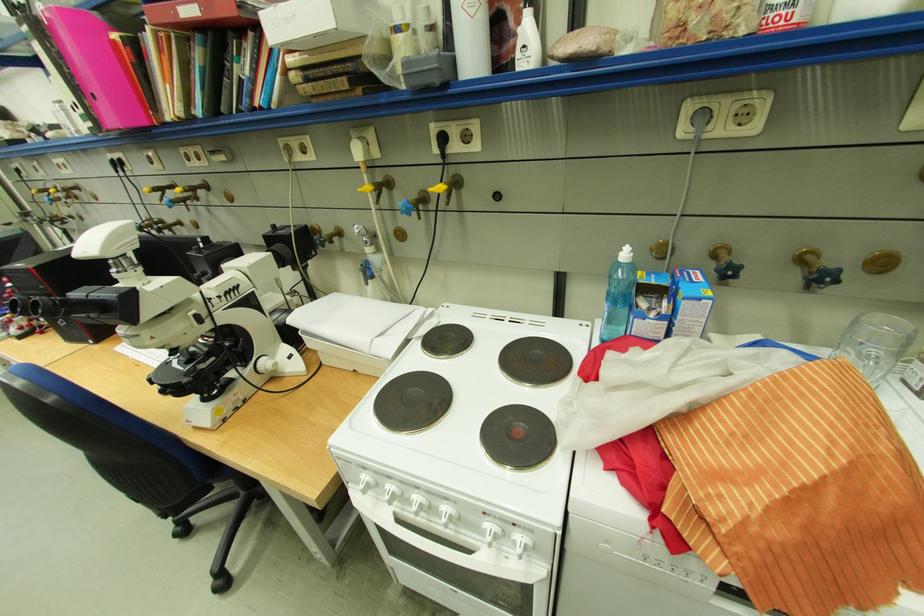
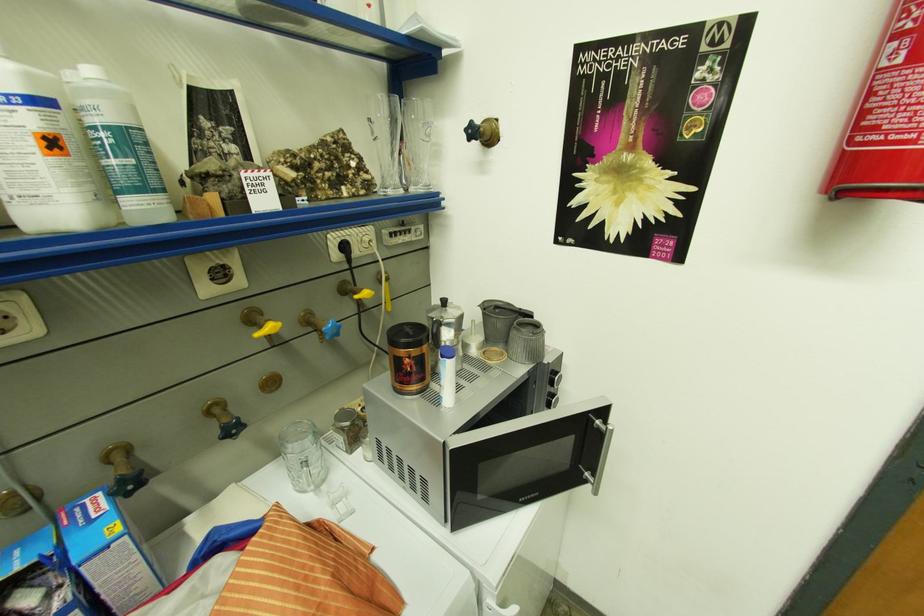
Locate, in the second image, the point that corresponds to the point at 815,251 in the first image.

(219, 405)